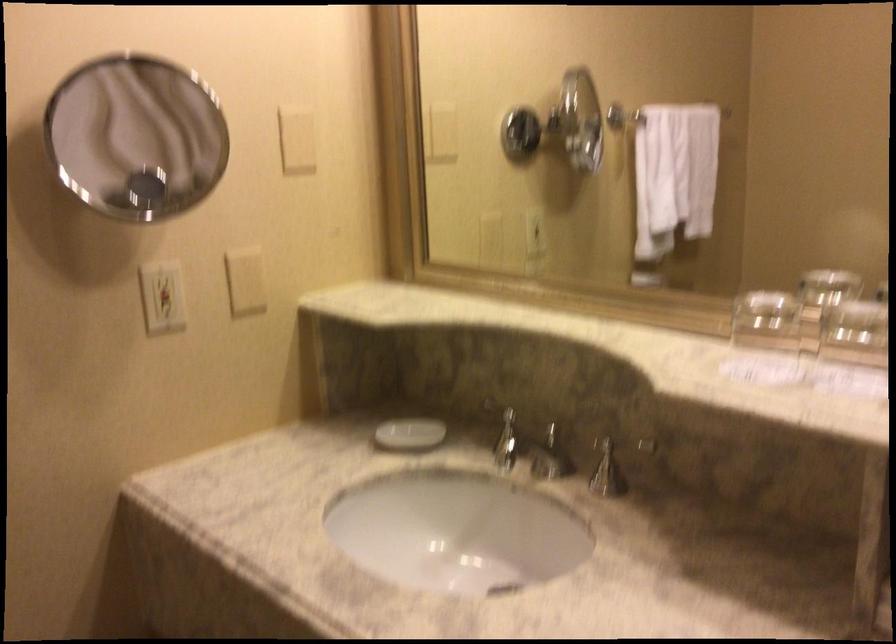
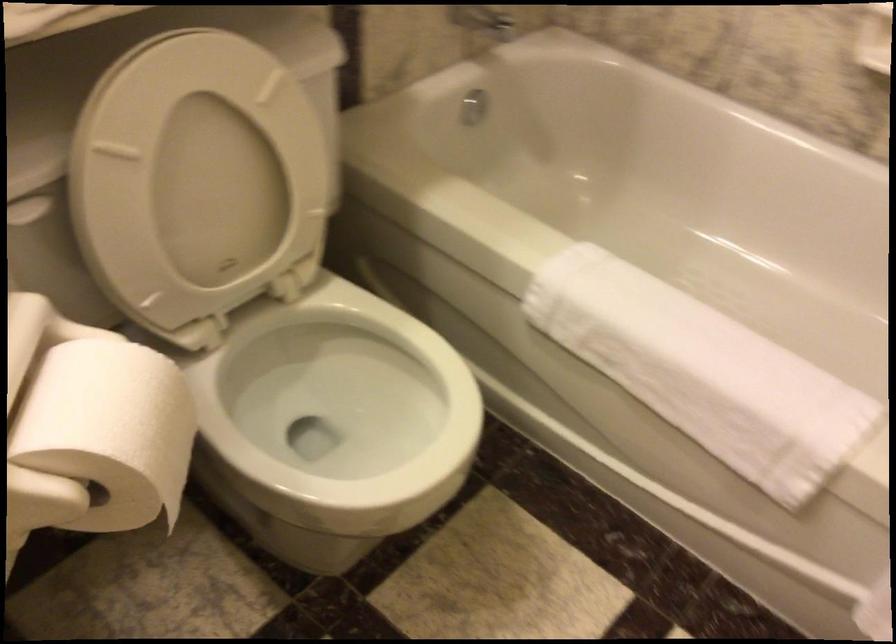
From the picture: Based on the continuous images, in which direction is the camera rotating?

The rotation direction of the camera is right-down.